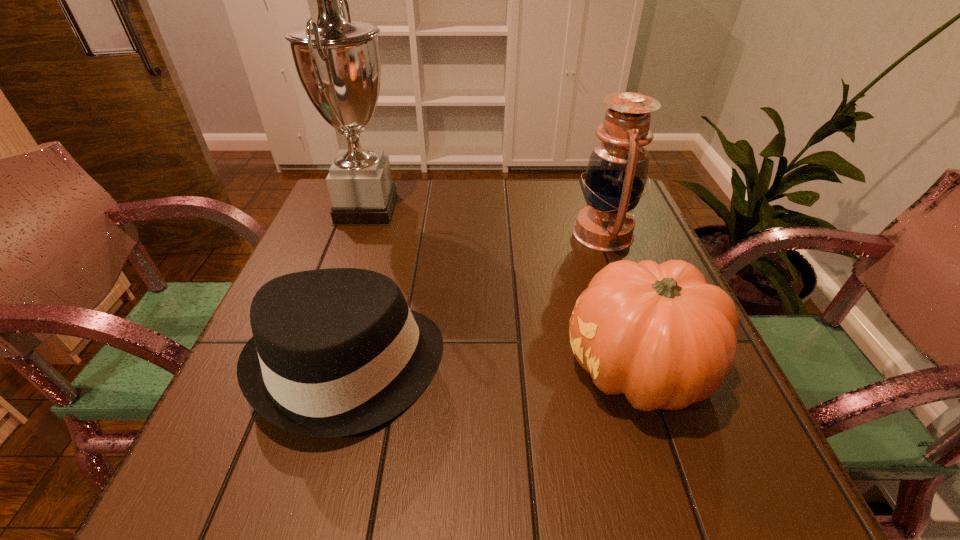
Find the location of a particular element. This screenshot has width=960, height=540. free spot between the fedora and the oil lamp is located at coordinates (476, 300).

Select which object is the second closest to the fedora. Please provide its 2D coordinates. Your answer should be formatted as a tuple, i.e. [(x, y)], where the tuple contains the x and y coordinates of a point satisfying the conditions above.

[(658, 333)]

The image size is (960, 540). Identify the location of object that can be found as the closest to the oil lamp. (658, 333).

In order to click on vacant space that satisfies the following two spatial constraints: 1. on the front side of the third shortest object; 2. on the carved face of the pumpkin in this screenshot , I will do `click(652, 369)`.

Identify the location of vacant space that satisfies the following two spatial constraints: 1. at the front view of the trophy cup; 2. on the right side of the fedora. The width and height of the screenshot is (960, 540). (310, 367).

Identify the location of free location that satisfies the following two spatial constraints: 1. on the back side of the oil lamp; 2. at the front view of the tallest object. (594, 210).

Where is `vacant region that satisfies the following two spatial constraints: 1. at the front view of the tallest object; 2. on the right side of the shortest object`? This screenshot has width=960, height=540. vacant region that satisfies the following two spatial constraints: 1. at the front view of the tallest object; 2. on the right side of the shortest object is located at coordinates (310, 367).